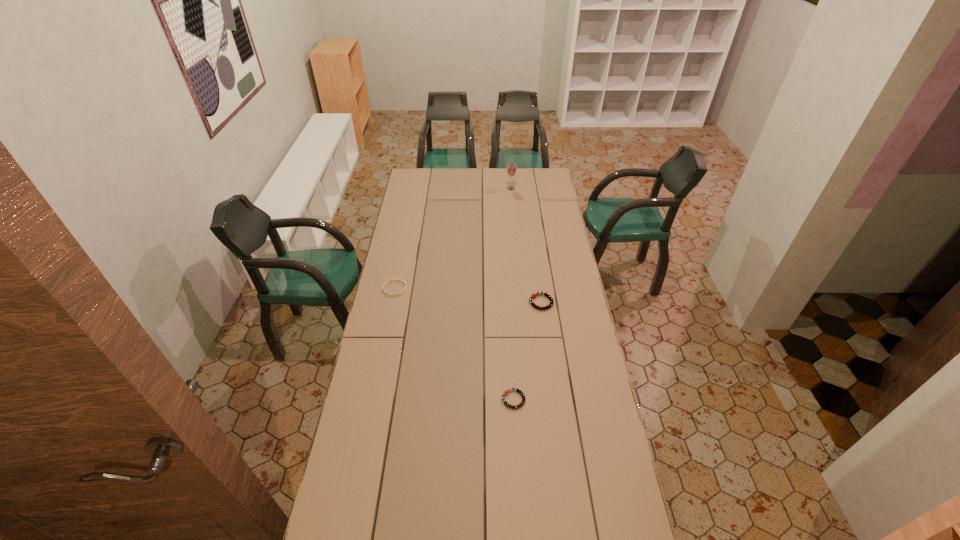
You are a GUI agent. You are given a task and a screenshot of the screen. Output one action in this format:
    pyautogui.click(x=<x>, y=<y>)
    Task: Click on the free space between the wineglass and the leftmost object
    This screenshot has width=960, height=540.
    Given the screenshot: What is the action you would take?
    point(453,238)

Where is `vacant point located between the tallest object and the leftmost object`? The image size is (960, 540). vacant point located between the tallest object and the leftmost object is located at coordinates (453, 238).

You are a GUI agent. You are given a task and a screenshot of the screen. Output one action in this format:
    pyautogui.click(x=<x>, y=<y>)
    Task: Click on the unoccupied position between the rightmost bracelet and the leftmost object
    
    Given the screenshot: What is the action you would take?
    pyautogui.click(x=468, y=295)

Image resolution: width=960 pixels, height=540 pixels. What are the coordinates of `vacant space that is in between the wineglass and the second bracelet from right to left` in the screenshot? It's located at (512, 294).

You are a GUI agent. You are given a task and a screenshot of the screen. Output one action in this format:
    pyautogui.click(x=<x>, y=<y>)
    Task: Click on the free point between the nearest object and the rightmost bracelet
    
    Given the screenshot: What is the action you would take?
    pyautogui.click(x=527, y=351)

Where is `vacant point located between the rightmost bracelet and the nearest object`? Image resolution: width=960 pixels, height=540 pixels. vacant point located between the rightmost bracelet and the nearest object is located at coordinates [527, 351].

Image resolution: width=960 pixels, height=540 pixels. I want to click on empty space between the leftmost bracelet and the rightmost bracelet, so click(x=468, y=295).

Identify the location of the third closest object to the rightmost bracelet. tap(511, 168).

Where is `object that is the closest to the leftmost bracelet`? The image size is (960, 540). object that is the closest to the leftmost bracelet is located at coordinates (533, 296).

Choose which bracelet is the nearest neighbor to the rightmost bracelet. Please provide its 2D coordinates. Your answer should be formatted as a tuple, i.e. [(x, y)], where the tuple contains the x and y coordinates of a point satisfying the conditions above.

[(505, 392)]